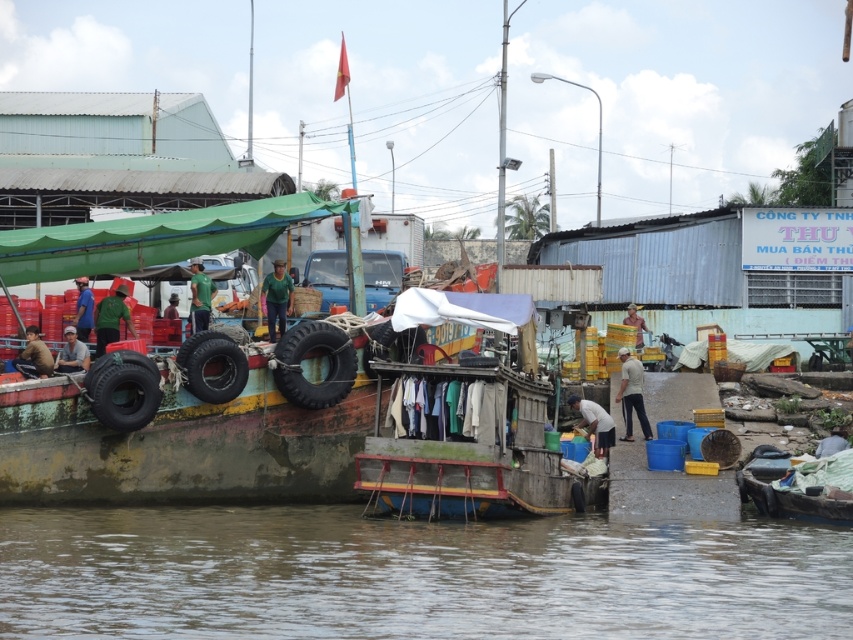
Is wooden boat at center further to camera compared to matte black shirt at left?

No, wooden boat at center is in front of matte black shirt at left.

Who is higher up, wooden boat at center or matte black shirt at left?

matte black shirt at left is above.

Image resolution: width=853 pixels, height=640 pixels. What are the coordinates of `wooden boat at center` in the screenshot? It's located at (468, 445).

Is white matte shirt at center positioned in front of green fabric shirt at center?

Yes.

Which of these two, white matte shirt at center or green fabric shirt at center, stands taller?

white matte shirt at center

Which is behind, point (647, 435) or point (189, 317)?

Positioned behind is point (189, 317).

You are a GUI agent. You are given a task and a screenshot of the screen. Output one action in this format:
    pyautogui.click(x=<x>, y=<y>)
    Task: Click on the white matte shirt at center
    
    Given the screenshot: What is the action you would take?
    pyautogui.click(x=631, y=394)

You are a GUI agent. You are given a task and a screenshot of the screen. Output one action in this format:
    pyautogui.click(x=<x>, y=<y>)
    Task: Click on the white fabric bag at lower center
    
    Given the screenshot: What is the action you would take?
    pyautogui.click(x=595, y=422)

Which is behind, point (606, 429) or point (70, 355)?

Positioned behind is point (606, 429).

This screenshot has width=853, height=640. Identify the location of white fabric bag at lower center. point(595,422).